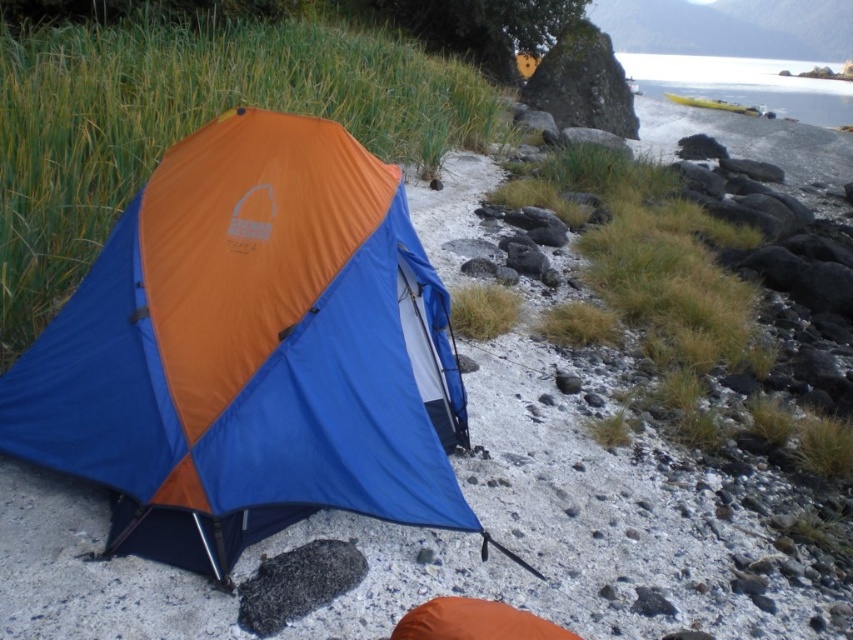
Describe the element at coordinates (252, 352) in the screenshot. I see `orange fabric tent at center` at that location.

Can you confirm if orange fabric tent at center is wider than yellow plastic kayak at upper right?

No.

Does point (100, 352) come closer to viewer compared to point (730, 106)?

Yes, point (100, 352) is closer to viewer.

At what (x,y) coordinates should I click in order to perform the action: click on orange fabric tent at center. Please return your answer as a coordinate pair (x, y). This screenshot has height=640, width=853. Looking at the image, I should click on (252, 352).